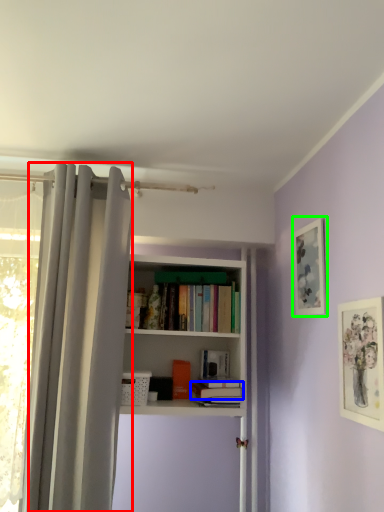
Question: Based on their relative distances, which object is nearer to curtain (highlighted by a red box)? Choose from book (highlighted by a blue box) and picture frame (highlighted by a green box).

Choices:
 (A) book
 (B) picture frame

Answer: (A)